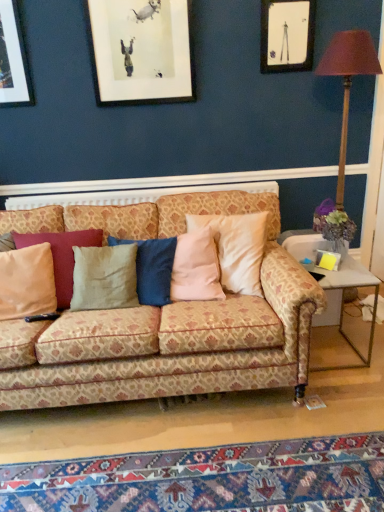
Question: In terms of size, does carpet with intricate patterns at lower center appear bigger or smaller than matte black picture frame at upper right?

Choices:
 (A) small
 (B) big

Answer: (B)

Question: From a real-world perspective, is carpet with intricate patterns at lower center positioned above or below matte black picture frame at upper right?

Choices:
 (A) above
 (B) below

Answer: (B)

Question: Estimate the real-world distances between objects in this image. Which object is farther from the patterned fabric couch at center?

Choices:
 (A) matte black picture frame at upper right
 (B) carpet with intricate patterns at lower center
 (C) metallic gold table lamp at right
 (D) beige fabric pillow at left
 (E) metal/glass side table at lower right

Answer: (C)

Question: Considering the real-world distances, which object is farthest from the metal/glass side table at lower right?

Choices:
 (A) metallic gold table lamp at right
 (B) carpet with intricate patterns at lower center
 (C) beige fabric pillow at left
 (D) patterned fabric couch at center
 (E) matte black picture frame at upper right

Answer: (E)